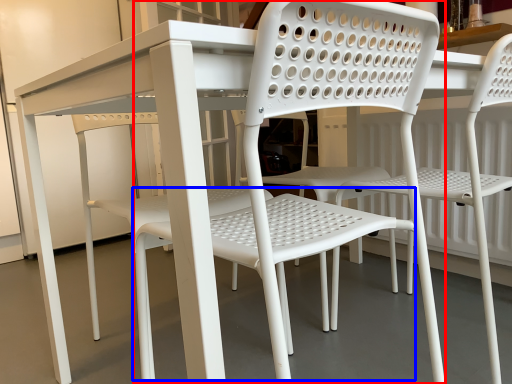
Question: Which object is closer to the camera taking this photo, chair (highlighted by a red box) or bar stool (highlighted by a blue box)?

Choices:
 (A) chair
 (B) bar stool

Answer: (A)